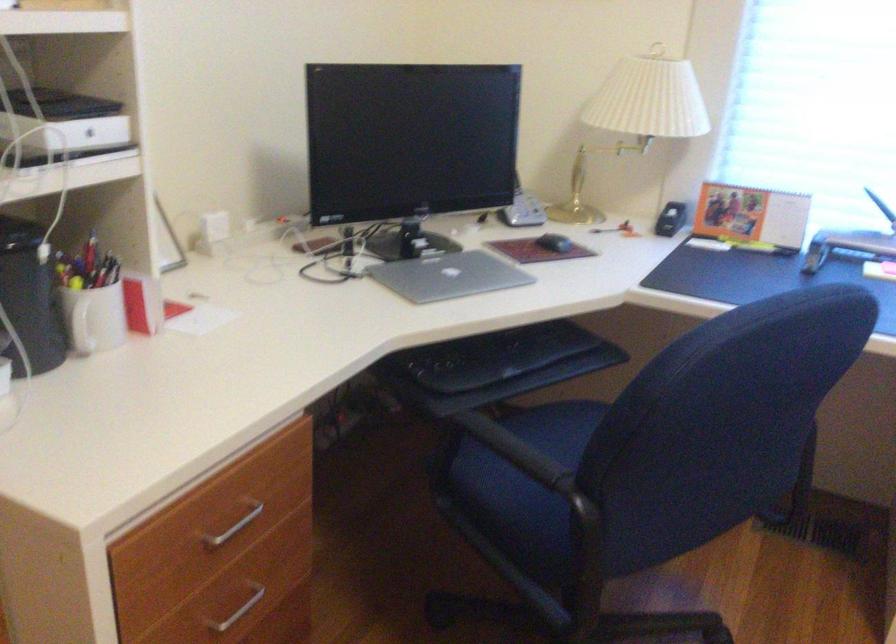
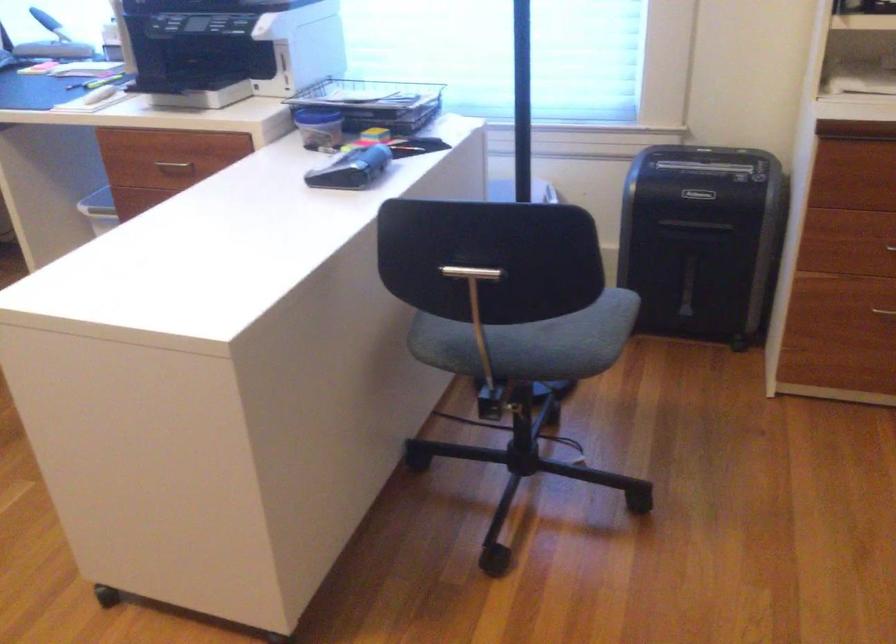
Which direction would the cameraman need to move to produce the second image?

The cameraman moved toward right, backward.